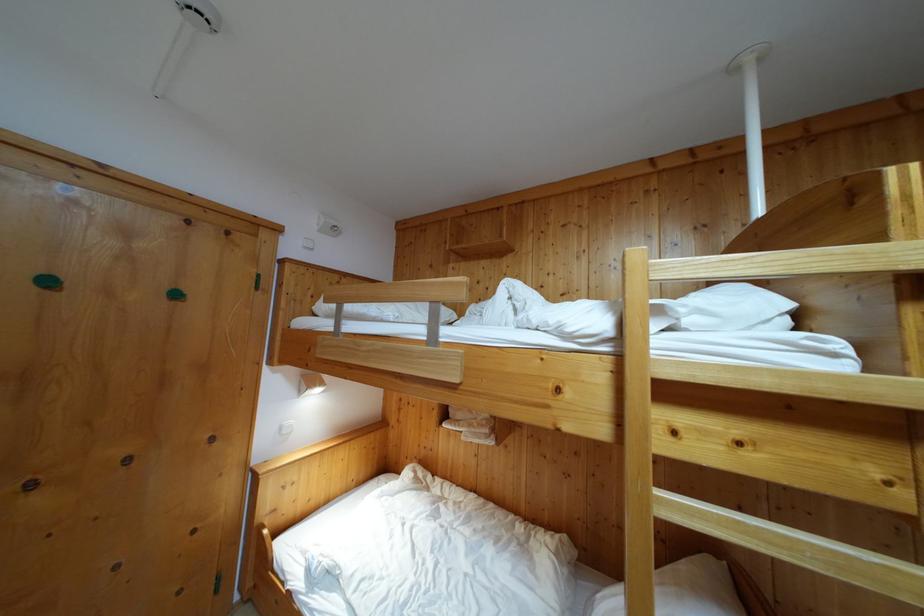
What do you see at coordinates (403, 292) in the screenshot? The height and width of the screenshot is (616, 924). I see `the wooden bed rail` at bounding box center [403, 292].